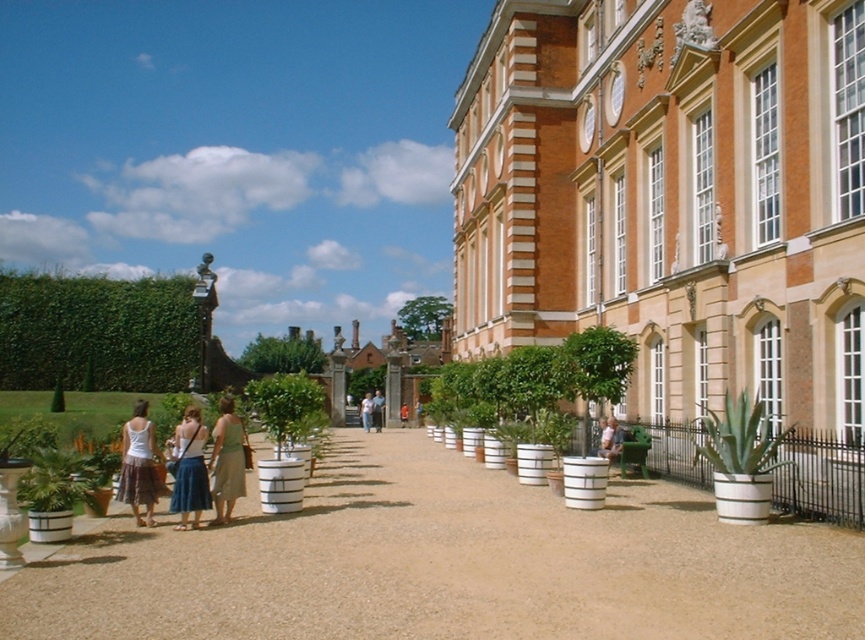
Which is behind, point (796, 340) or point (133, 449)?

The point (796, 340) is behind.

Is white textured planter at center shorter than white cotton tank top at center?

In fact, white textured planter at center may be taller than white cotton tank top at center.

What are the coordinates of `white textured planter at center` in the screenshot? It's located at (677, 211).

Which of these two, denim skirt at lower left or green fabric dress at center, stands taller?

Standing taller between the two is green fabric dress at center.

Describe the element at coordinates (189, 468) in the screenshot. I see `denim skirt at lower left` at that location.

Find the location of a particular element. Image resolution: width=865 pixels, height=640 pixels. denim skirt at lower left is located at coordinates coord(189,468).

Can you confirm if white textured planter at center is positioned below green fabric dress at center?

No.

Is point (536, 44) more distant than point (239, 474)?

Yes, point (536, 44) is farther from viewer.

Where is `white textured planter at center`? The image size is (865, 640). white textured planter at center is located at coordinates (677, 211).